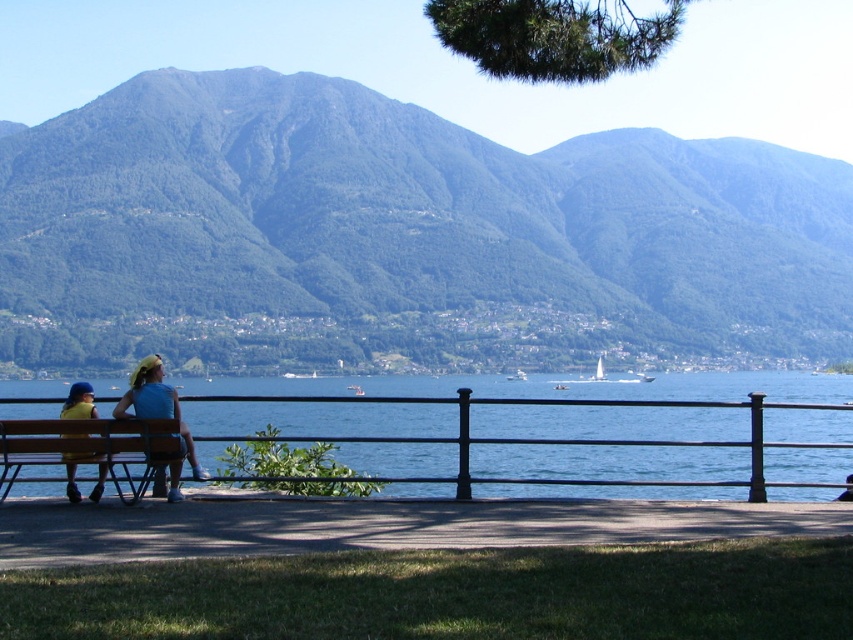
You are a maintenance worker who needs to move a 24 inch long tool cart from the wooden bench at lower left to the yellow fabric bench at center. Can you safely move the tool cart without it extending beyond the space between them?

The wooden bench at lower left is 24.56 inches away from the yellow fabric bench at center. Since the tool cart is 24 inches long, it can be safely moved between them as the distance is sufficient.

You are planning to take a photo of the green forested mountain at upper center and the wooden bench at lower left. Which object would you need to frame wider in your camera viewfinder?

The green forested mountain at upper center might be wider than the wooden bench at lower left, so you should frame the green forested mountain at upper center wider in your camera viewfinder.